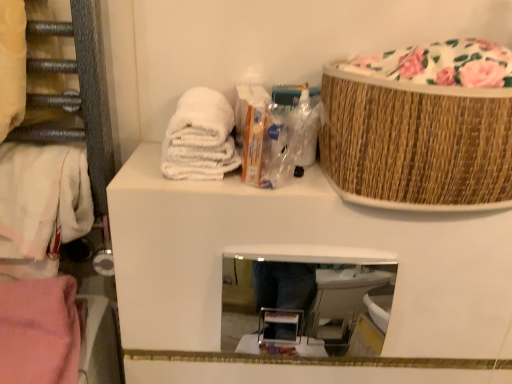
Question: From a real-world perspective, is white towel at upper left, the 2th material when ordered from bottom to top, physically located above or below bamboo textured basket at upper right?

Choices:
 (A) above
 (B) below

Answer: (B)

Question: From their relative heights in the image, would you say white towel at upper left, the 1th material positioned from the right, is taller or shorter than bamboo textured basket at upper right?

Choices:
 (A) tall
 (B) short

Answer: (B)

Question: Which is nearer to the floral fabric basket at upper right?

Choices:
 (A) white towel at upper left, marked as the 2th material in a left-to-right arrangement
 (B) clear glass mirror at center
 (C) pink fabric towel at lower left, the first material when ordered from left to right
 (D) white cotton towel at left
 (E) bamboo textured basket at upper right

Answer: (E)

Question: Estimate the real-world distances between objects in this image. Which object is farther from the floral fabric basket at upper right?

Choices:
 (A) clear glass mirror at center
 (B) white towel at upper left, which is counted as the 1th material, starting from the top
 (C) white cotton towel at left
 (D) pink fabric towel at lower left, arranged as the 1th material when ordered from the bottom
 (E) bamboo textured basket at upper right

Answer: (A)